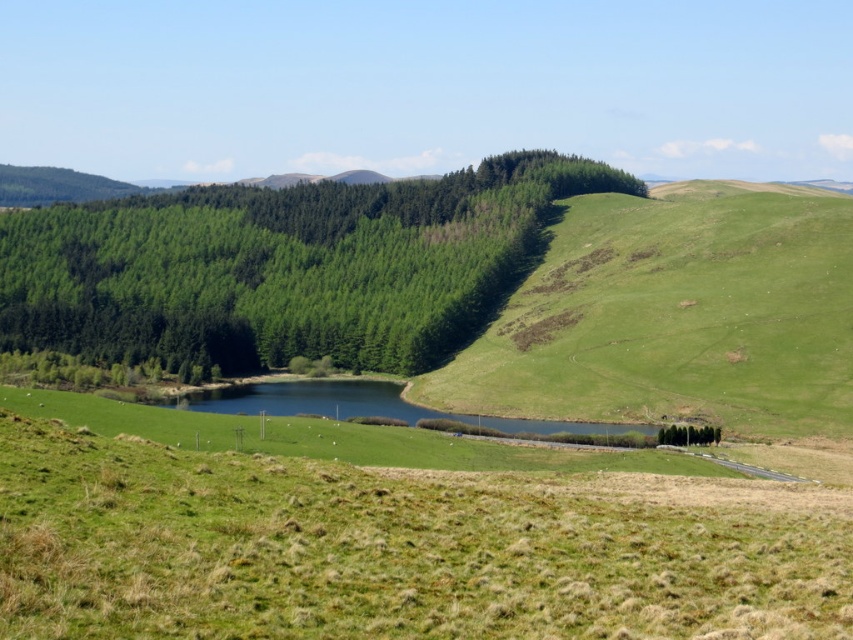
You are standing at the origin point in the image. Which direction should you walk to reach the green textured forest at center?

The green textured forest at center is located at coordinates point (285,266), so you should walk towards the center of the image to reach it.

You are standing at the origin point in the image and want to walk to the green grass at center. What direction should you head in?

Since the green grass at center is located at point 0.836 on the x axis and 0.460 on the y axis, you should head northeast to reach it.